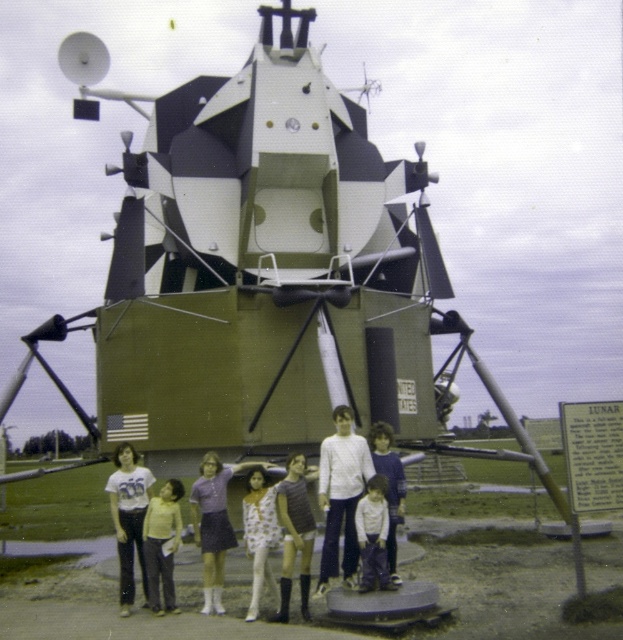
Question: Which object is closer to the camera taking this photo?

Choices:
 (A) light brown fabric pants at center
 (B) light brown fabric dress at center

Answer: (A)

Question: Is matte white pants at center closer to camera compared to white textured dress at center?

Choices:
 (A) yes
 (B) no

Answer: (A)

Question: Among these objects, which one is nearest to the camera?

Choices:
 (A) light brown fabric dress at center
 (B) matte white pants at center
 (C) light brown hair at center

Answer: (B)

Question: Is purple fabric skirt at center positioned at the back of light brown fabric dress at center?

Choices:
 (A) yes
 (B) no

Answer: (B)

Question: Which object appears closest to the camera in this image?

Choices:
 (A) purple fabric skirt at center
 (B) white floral dress at center

Answer: (B)

Question: In this image, where is white matte shirt at center located relative to light brown fabric dress at center?

Choices:
 (A) below
 (B) above

Answer: (A)